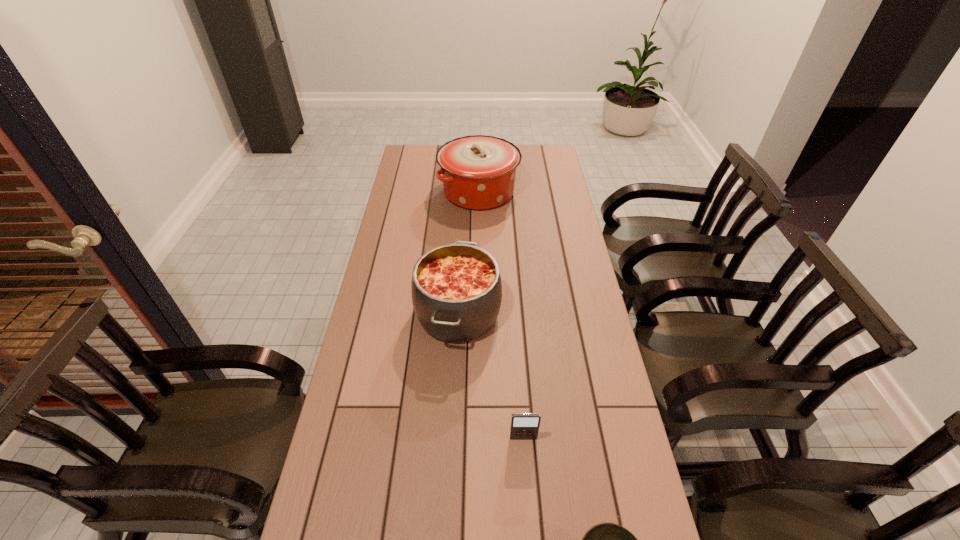
In the image, there is a desktop. Identify the location of free space at the right edge. (572, 260).

The width and height of the screenshot is (960, 540). In the image, there is a desktop. Find the location of `free region at the far right corner`. free region at the far right corner is located at coordinates (540, 162).

Where is `free space between the shorter casserole and the second shortest object`? This screenshot has width=960, height=540. free space between the shorter casserole and the second shortest object is located at coordinates (491, 376).

Find the location of a particular element. vacant region between the iPod and the shorter casserole is located at coordinates (491, 376).

This screenshot has width=960, height=540. What are the coordinates of `empty location between the third tallest object and the nearer casserole` in the screenshot? It's located at (491, 376).

The width and height of the screenshot is (960, 540). I want to click on free space between the farther casserole and the iPod, so click(x=501, y=315).

Identify the location of free area in between the farther casserole and the iPod. The width and height of the screenshot is (960, 540). (501, 315).

Identify the location of object identified as the third closest to the taller casserole. The height and width of the screenshot is (540, 960). (606, 539).

What are the coordinates of `object that stands as the third closest to the second tallest object` in the screenshot? It's located at (x=606, y=539).